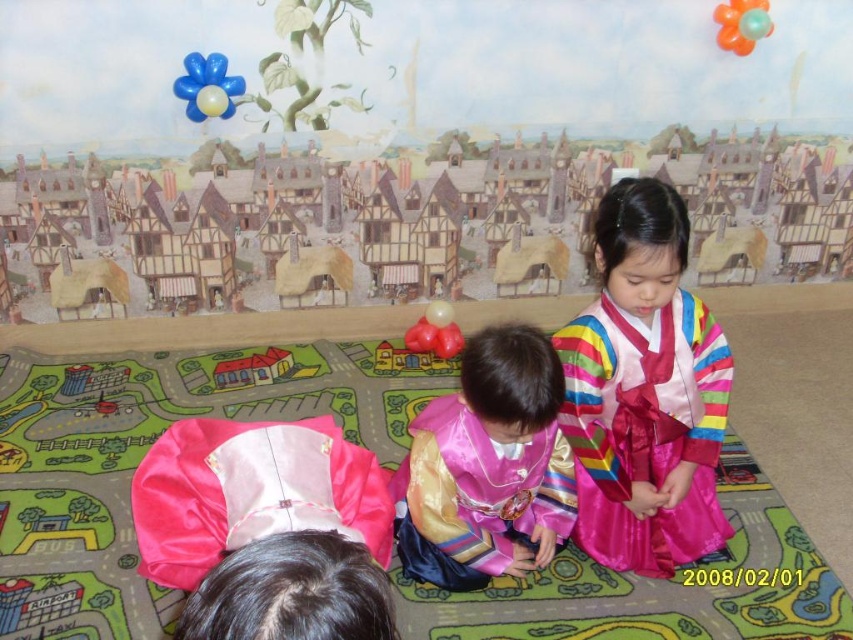
Does smooth red ball at center have a lesser height compared to matte plastic house at center?

No.

I want to click on smooth red ball at center, so click(x=434, y=332).

Where is `smooth red ball at center`? smooth red ball at center is located at coordinates (434, 332).

Which is above, silky pink hanbok at center or matte plastic house at center?

Positioned higher is matte plastic house at center.

Is silky pink hanbok at center thinner than matte plastic house at center?

Incorrect, silky pink hanbok at center's width is not less than matte plastic house at center's.

Between point (656, 428) and point (274, 365), which one is positioned in front?

Point (656, 428) is more forward.

Image resolution: width=853 pixels, height=640 pixels. What are the coordinates of `silky pink hanbok at center` in the screenshot? It's located at (645, 429).

Between silky pink hanbok at center and smooth red ball at center, which one is positioned lower?

silky pink hanbok at center is below.

Does point (628, 387) come farther from viewer compared to point (432, 324)?

No.

Describe the element at coordinates (645, 429) in the screenshot. I see `silky pink hanbok at center` at that location.

I want to click on silky pink hanbok at center, so click(x=645, y=429).